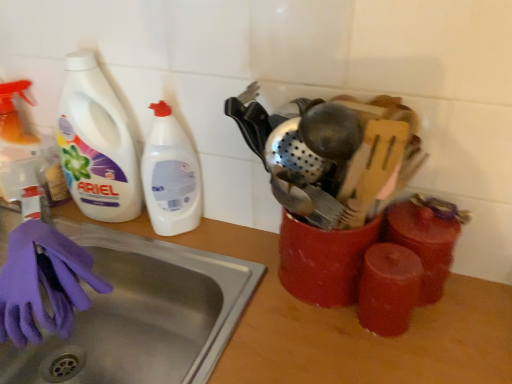
Where is `vacant space to the right of white plastic bottle at left`? Image resolution: width=512 pixels, height=384 pixels. vacant space to the right of white plastic bottle at left is located at coordinates (225, 240).